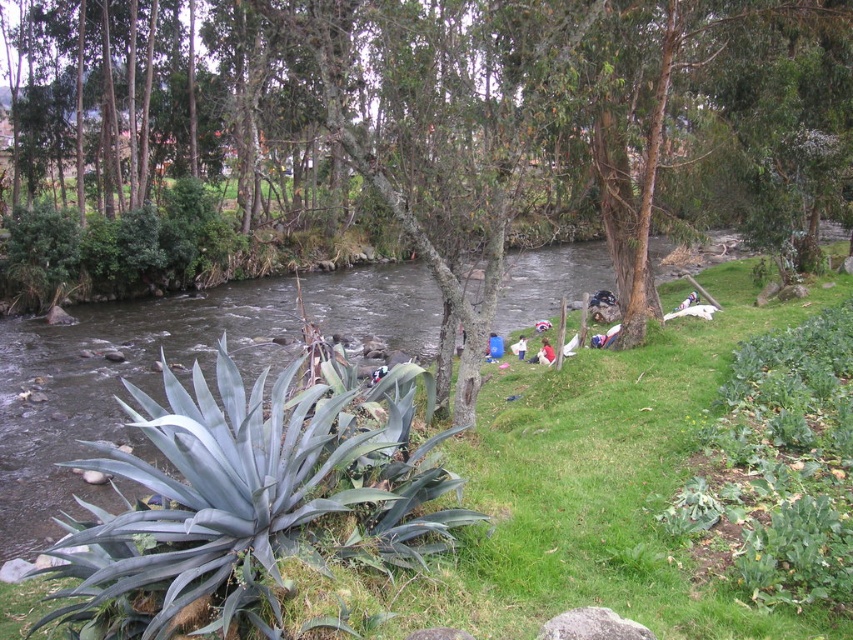
You are standing at the edge of the river and want to walk towards the green leafy tree at center. Which direction should you head relative to the green grass at lower left?

You should head to the right relative to the green grass at lower left because the green leafy tree at center is located to the left of the green grass at lower left, meaning it is positioned in the opposite direction.

You are an observer standing at the riverside. You notice a green leafy tree at center and a white cotton shirt at lower center. Which object is wider when viewed from your position?

The green leafy tree at center is wider than the white cotton shirt at lower center.